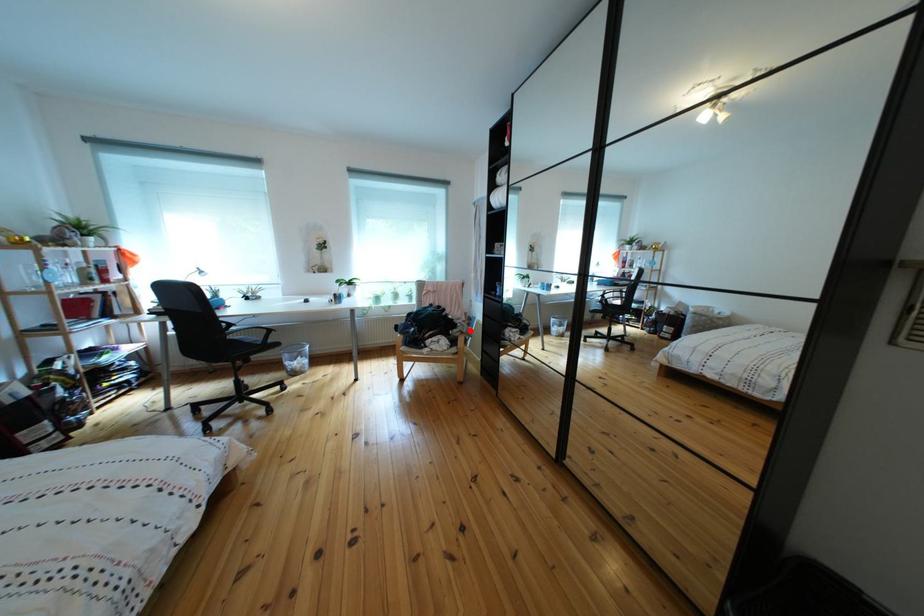
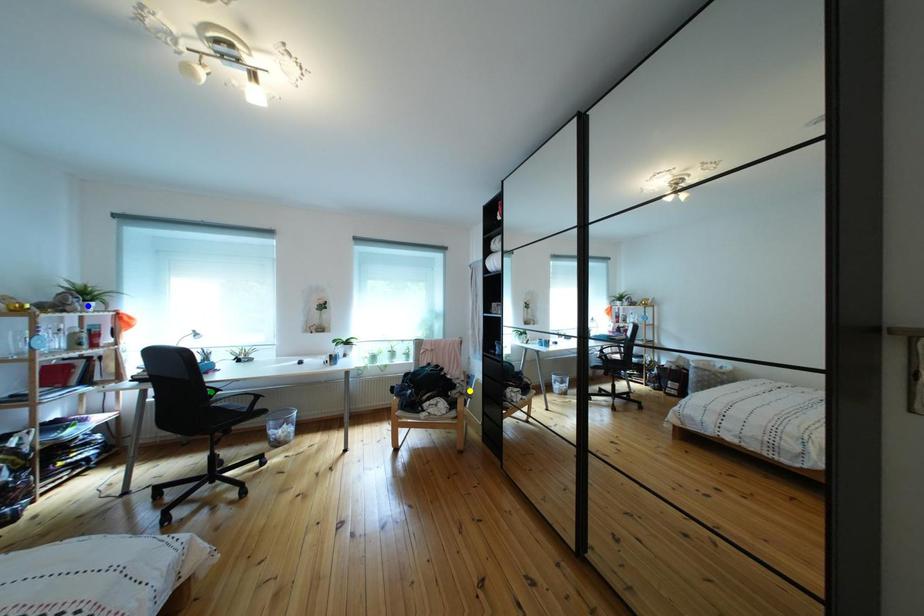
Question: I am providing you with two images of the same scene from different viewpoints. A red point is marked on the first image. You are given multiple points on the second image. Which point in image 2 represents the same 3d spot as the red point in image 1?

Choices:
 (A) blue point
 (B) yellow point
 (C) green point

Answer: (B)